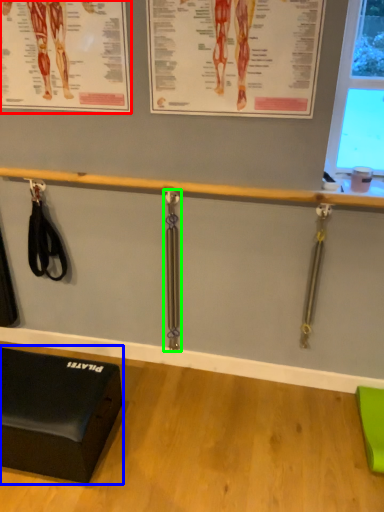
Question: Which object is the farthest from poster page (highlighted by a red box)? Choose among these: furniture (highlighted by a blue box) or weight (highlighted by a green box).

Choices:
 (A) furniture
 (B) weight

Answer: (A)